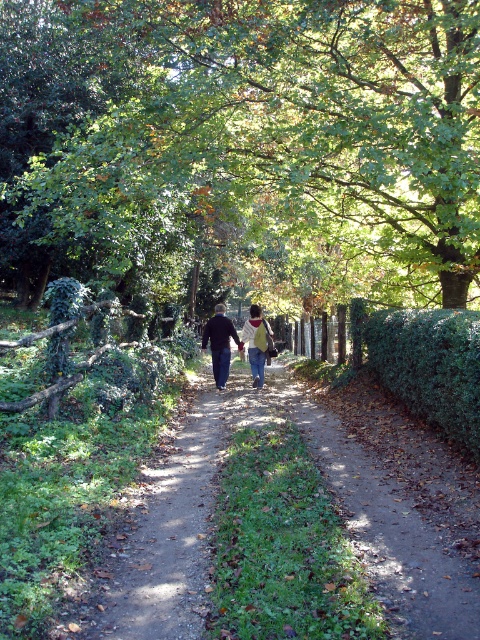
You are a hiker planning to walk along the dirt path. You see the green leafy hedge at right and the yellow fabric backpack at center. Which object is closer to the ground?

The green leafy hedge at right is below the yellow fabric backpack at center, so the green leafy hedge at right is closer to the ground.

You are a hiker planning to walk along the dirt path. You see the green leafy hedge at right and the denim jacket at center. Which object is closer to the ground?

The green leafy hedge at right is below denim jacket at center, so the green leafy hedge at right is closer to the ground.

You are a hiker carrying a yellow fabric backpack at center and want to pass through the green leafy hedge at right. Can you fit through the hedge without squeezing?

The green leafy hedge at right is thinner than the yellow fabric backpack at center, so it is narrower than the backpack. This means the backpack might not fit through the hedge without squeezing or adjusting the backpack first.